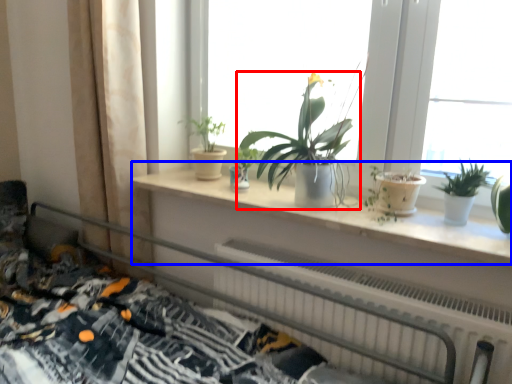
Question: Among these objects, which one is nearest to the camera, houseplant (highlighted by a red box) or window sill (highlighted by a blue box)?

Choices:
 (A) houseplant
 (B) window sill

Answer: (B)